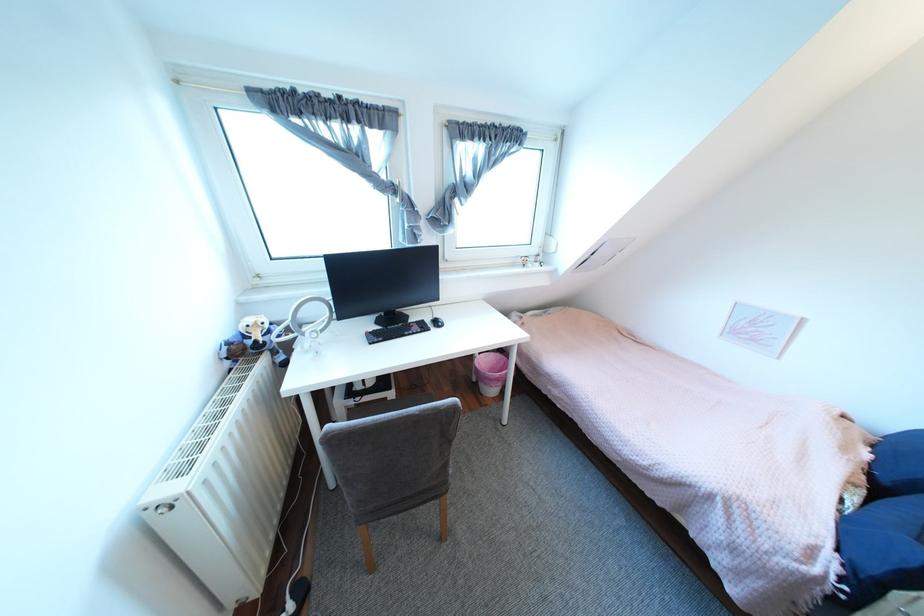
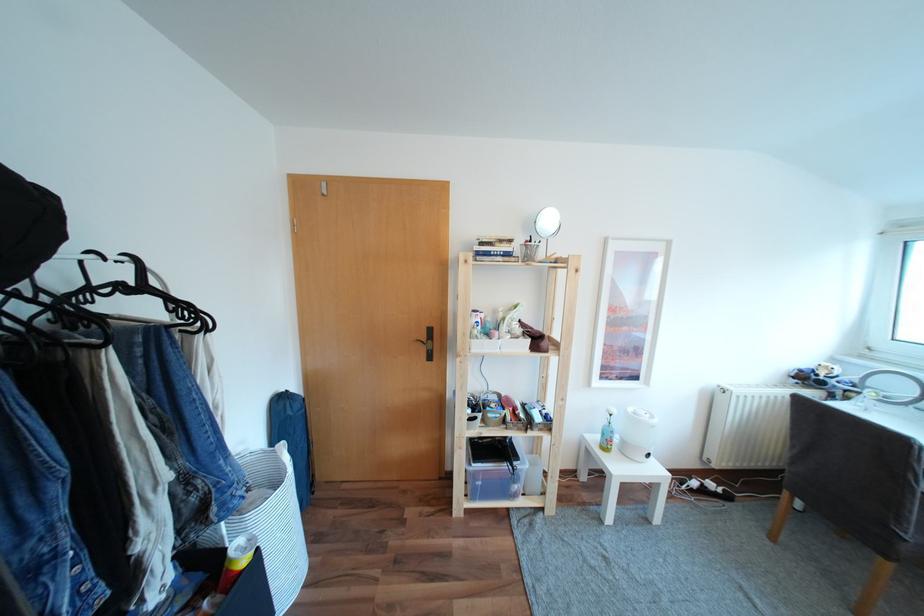
Find the pixel in the second image that matches pixel 239 342 in the first image.

(810, 371)